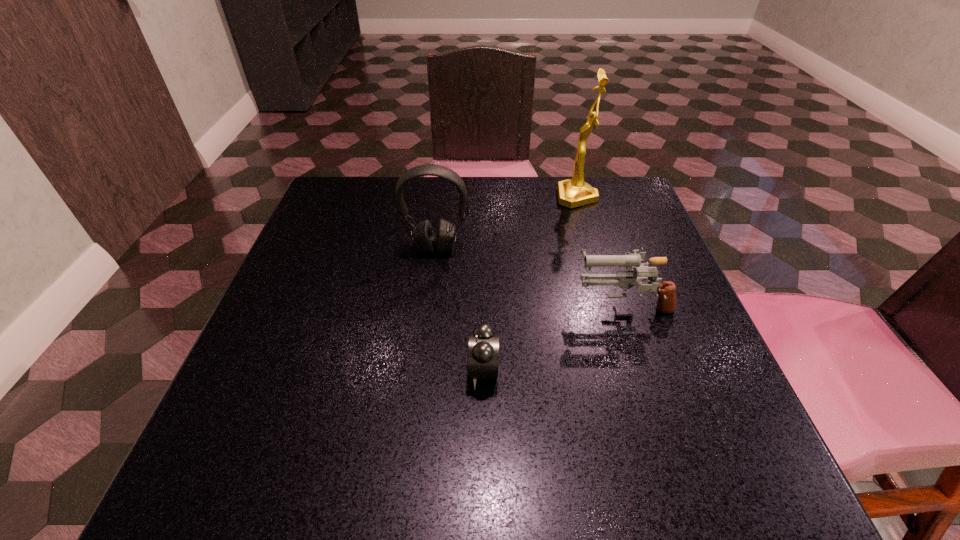
The height and width of the screenshot is (540, 960). What are the coordinates of `vacant area between the gun and the shortest object` in the screenshot? It's located at (553, 336).

What are the coordinates of `free point between the leftmost object and the third tallest object` in the screenshot? It's located at (x=529, y=275).

Identify the location of vacant space in between the leftmost object and the alarm clock. (460, 308).

Where is `vacant space in between the third shortest object and the second object from left to right`? The width and height of the screenshot is (960, 540). vacant space in between the third shortest object and the second object from left to right is located at coordinates (460, 308).

Locate an element on the screen. The image size is (960, 540). free space between the nearest object and the second farthest object is located at coordinates (460, 308).

The image size is (960, 540). Find the location of `vacant region between the gun and the leftmost object`. vacant region between the gun and the leftmost object is located at coordinates (529, 275).

What are the coordinates of `vacant region between the nearest object and the award` in the screenshot? It's located at (530, 284).

In order to click on free space that is in between the third shortest object and the farthest object in this screenshot , I will do `click(507, 222)`.

Locate an element on the screen. vacant space that is in between the third tallest object and the shortest object is located at coordinates (553, 336).

Find the location of `object identified as the closest to the gun`. object identified as the closest to the gun is located at coordinates (483, 343).